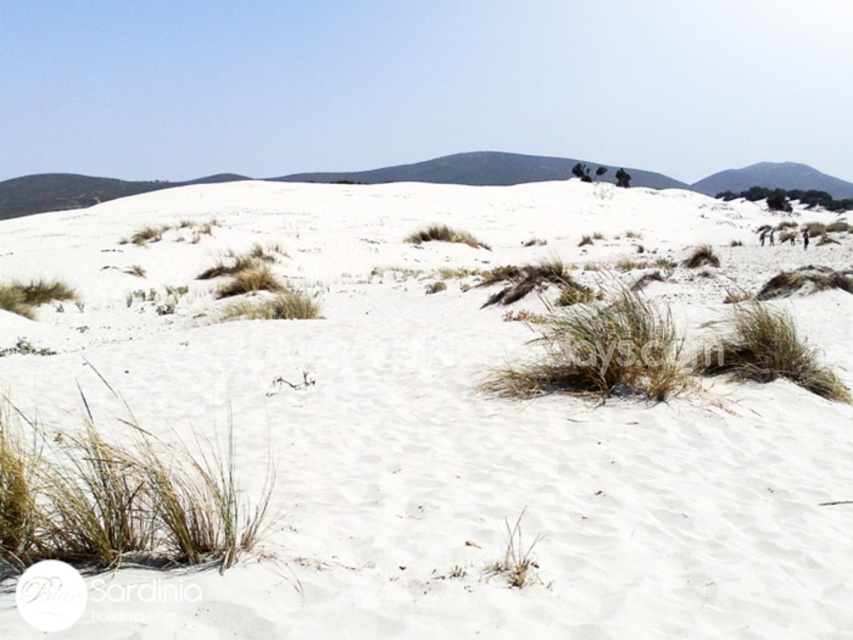
Question: Is white sand dune at center positioned behind green fibrous grass at lower right?

Choices:
 (A) yes
 (B) no

Answer: (B)

Question: Which object is the closest to the green leafy shrubs at upper right?

Choices:
 (A) green grass at lower left
 (B) white sand dune at center
 (C) green fibrous grass at lower right

Answer: (B)

Question: Does white sand dune at center have a smaller size compared to green grass at lower left?

Choices:
 (A) yes
 (B) no

Answer: (B)

Question: Estimate the real-world distances between objects in this image. Which object is closer to the green grass at lower left?

Choices:
 (A) green grassy hill at upper right
 (B) green fibrous grass at lower right

Answer: (B)

Question: Is white sand dune at center positioned at the back of green leafy shrubs at upper right?

Choices:
 (A) yes
 (B) no

Answer: (B)

Question: Which point is closer to the camera?

Choices:
 (A) green fibrous grass at lower right
 (B) green leafy shrubs at upper right
 (C) green grassy hill at upper right
 (D) white sand dune at center

Answer: (D)